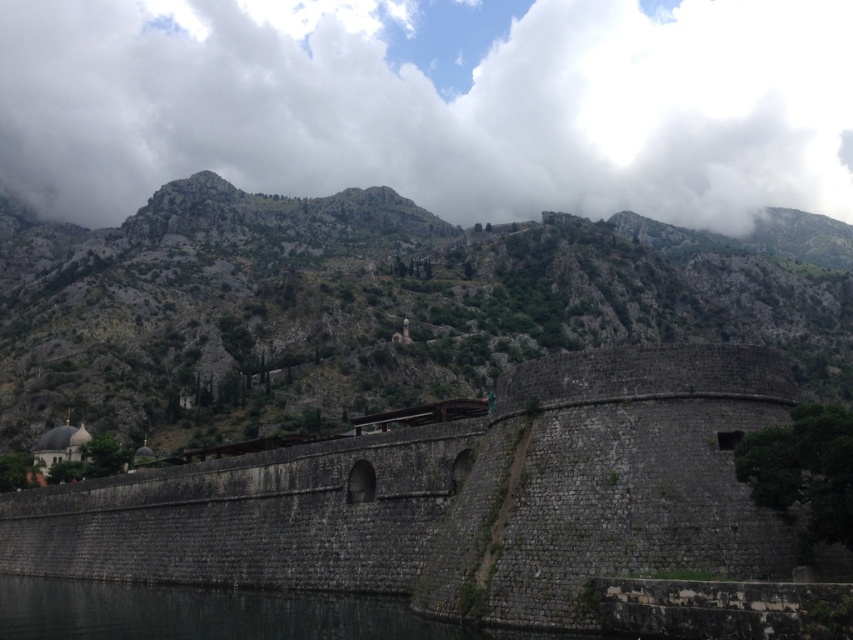
Question: Is the position of white fluffy cloud at upper center less distant than that of dark gray water at lower left?

Choices:
 (A) no
 (B) yes

Answer: (A)

Question: Does white fluffy cloud at upper center appear on the right side of dark gray water at lower left?

Choices:
 (A) no
 (B) yes

Answer: (B)

Question: Which point appears farthest from the camera in this image?

Choices:
 (A) (375, 614)
 (B) (119, 570)

Answer: (B)

Question: Which object is farther from the camera taking this photo?

Choices:
 (A) dark gray water at lower left
 (B) white fluffy cloud at upper center
 (C) dark stone wall at center
 (D) rugged stone mountain at center

Answer: (B)

Question: Which point is farther from the camera taking this photo?

Choices:
 (A) (207, 243)
 (B) (16, 621)
 (C) (740, 524)

Answer: (A)

Question: Can you confirm if rugged stone mountain at center is positioned below dark stone wall at center?

Choices:
 (A) yes
 (B) no

Answer: (B)